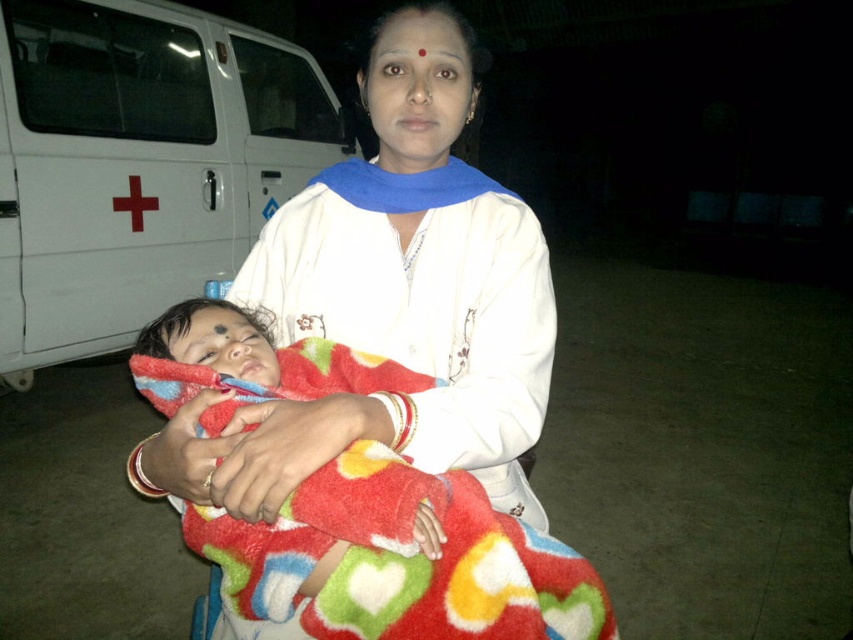
Question: Which object is the closest to the pink matte lips at center?

Choices:
 (A) white matte van at left
 (B) fluffy multicolored blanket at center

Answer: (B)

Question: Is fluffy multicolored blanket at center further to camera compared to pink matte lips at center?

Choices:
 (A) yes
 (B) no

Answer: (B)

Question: Among these objects, which one is nearest to the camera?

Choices:
 (A) fluffy multicolored blanket at center
 (B) white soft cloth at center
 (C) white matte van at left

Answer: (A)

Question: Considering the real-world distances, which object is closest to the white matte van at left?

Choices:
 (A) fluffy multicolored blanket at center
 (B) white soft cloth at center

Answer: (B)

Question: Is white soft cloth at center below pink matte lips at center?

Choices:
 (A) no
 (B) yes

Answer: (B)

Question: Does white soft cloth at center lie behind pink matte lips at center?

Choices:
 (A) yes
 (B) no

Answer: (B)